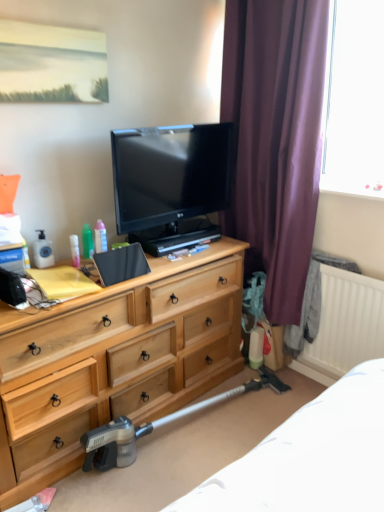
Locate an element on the screen. white matte radiator at lower right is located at coordinates (344, 326).

What do you see at coordinates (172, 183) in the screenshot? The width and height of the screenshot is (384, 512). I see `matte black tv at center` at bounding box center [172, 183].

What is the approximate width of light wood dresser at center?

light wood dresser at center is 20.67 inches wide.

What do you see at coordinates (113, 361) in the screenshot? The height and width of the screenshot is (512, 384). I see `light wood dresser at center` at bounding box center [113, 361].

Locate an element on the screen. purple velvet curtain at right is located at coordinates (275, 139).

Describe the element at coordinates (100, 237) in the screenshot. I see `translucent plastic spray bottle at center-left, acting as the 1th toiletry starting from the right` at that location.

The height and width of the screenshot is (512, 384). Identify the location of white matte radiator at lower right. (344, 326).

Based on the photo, is white matte radiator at lower right wider or thinner than translucent plastic tube at center left, marked as the third toiletry in a right-to-left arrangement?

white matte radiator at lower right is wider than translucent plastic tube at center left, marked as the third toiletry in a right-to-left arrangement.

There is a white matte radiator at lower right. At what (x,y) coordinates should I click in order to perform the action: click on the 1st toiletry above it (from the image's perspective). Please return your answer as a coordinate pair (x, y). Looking at the image, I should click on (x=75, y=251).

Is white matte radiator at lower right facing away from translucent plastic tube at center left, acting as the 1th toiletry starting from the left?

No, white matte radiator at lower right is not facing the opposite direction of translucent plastic tube at center left, acting as the 1th toiletry starting from the left.

Which is more to the left, white matte radiator at lower right or translucent plastic tube at center left, acting as the 1th toiletry starting from the left?

translucent plastic tube at center left, acting as the 1th toiletry starting from the left.

Is light wood dresser at center next to white matte radiator at lower right?

They are not placed beside each other.

From the picture: Is the position of light wood dresser at center less distant than that of white matte radiator at lower right?

That is True.

Does light wood dresser at center have a lesser width compared to white matte radiator at lower right?

No, light wood dresser at center is not thinner than white matte radiator at lower right.

Which object is further away from the camera taking this photo, translucent plastic tube at center left, marked as the third toiletry in a right-to-left arrangement, or metallic gray vacuum cleaner at lower center?

translucent plastic tube at center left, marked as the third toiletry in a right-to-left arrangement, is more distant.

Which object is positioned more to the right, translucent plastic tube at center left, acting as the 1th toiletry starting from the left, or metallic gray vacuum cleaner at lower center?

Positioned to the right is metallic gray vacuum cleaner at lower center.

From the image's perspective, is translucent plastic tube at center left, marked as the third toiletry in a right-to-left arrangement, below metallic gray vacuum cleaner at lower center?

No.

Is translucent plastic tube at center left, marked as the third toiletry in a right-to-left arrangement, wider than metallic gray vacuum cleaner at lower center?

No, translucent plastic tube at center left, marked as the third toiletry in a right-to-left arrangement, is not wider than metallic gray vacuum cleaner at lower center.

Visually, is green plastic bottle at upper left, the second toiletry from the right, positioned to the left or to the right of translucent plastic spray bottle at center-left, acting as the 1th toiletry starting from the right?

In the image, green plastic bottle at upper left, the second toiletry from the right, appears on the left side of translucent plastic spray bottle at center-left, acting as the 1th toiletry starting from the right.

Is translucent plastic spray bottle at center-left, acting as the 1th toiletry starting from the right, surrounded by green plastic bottle at upper left, the second toiletry from the right?

Definitely not — translucent plastic spray bottle at center-left, acting as the 1th toiletry starting from the right, is not inside green plastic bottle at upper left, the second toiletry from the right.

Is point (82, 238) positioned in front of point (103, 226)?

Yes, it is.

Is green plastic bottle at upper left, the second toiletry positioned from the left, wider than translucent plastic spray bottle at center-left, acting as the 1th toiletry starting from the right?

Incorrect, the width of green plastic bottle at upper left, the second toiletry positioned from the left, does not surpass that of translucent plastic spray bottle at center-left, acting as the 1th toiletry starting from the right.

Is metallic gray vacuum cleaner at lower center thinner than translucent plastic spray bottle at center-left, the 3th toiletry when ordered from left to right?

No.

Are metallic gray vacuum cleaner at lower center and translucent plastic spray bottle at center-left, the 3th toiletry when ordered from left to right, located far from each other?

No.

Is metallic gray vacuum cleaner at lower center facing away from translucent plastic spray bottle at center-left, the 3th toiletry when ordered from left to right?

No, metallic gray vacuum cleaner at lower center is not facing away from translucent plastic spray bottle at center-left, the 3th toiletry when ordered from left to right.

In the scene shown: From a real-world perspective, is metallic gray vacuum cleaner at lower center on top of translucent plastic spray bottle at center-left, acting as the 1th toiletry starting from the right?

No, from a real-world perspective, metallic gray vacuum cleaner at lower center is not over translucent plastic spray bottle at center-left, acting as the 1th toiletry starting from the right

From the picture: Is purple velvet curtain at right positioned far away from light wood dresser at center?

No, purple velvet curtain at right is not far from light wood dresser at center.

Is light wood dresser at center a part of purple velvet curtain at right?

Definitely not — light wood dresser at center is not inside purple velvet curtain at right.

Considering the sizes of objects purple velvet curtain at right and light wood dresser at center in the image provided, who is thinner, purple velvet curtain at right or light wood dresser at center?

purple velvet curtain at right is thinner.

Could you tell me if purple velvet curtain at right is turned towards light wood dresser at center?

Yes, purple velvet curtain at right is aimed at light wood dresser at center.

Who is shorter, metallic gray vacuum cleaner at lower center or translucent plastic tube at center left, acting as the 1th toiletry starting from the left?

With less height is translucent plastic tube at center left, acting as the 1th toiletry starting from the left.

Is metallic gray vacuum cleaner at lower center positioned with its back to translucent plastic tube at center left, marked as the third toiletry in a right-to-left arrangement?

No, translucent plastic tube at center left, marked as the third toiletry in a right-to-left arrangement, is not at the back of metallic gray vacuum cleaner at lower center.

Considering the positions of objects metallic gray vacuum cleaner at lower center and translucent plastic tube at center left, marked as the third toiletry in a right-to-left arrangement, in the image provided, who is more to the right, metallic gray vacuum cleaner at lower center or translucent plastic tube at center left, marked as the third toiletry in a right-to-left arrangement,?

metallic gray vacuum cleaner at lower center is more to the right.

Which is behind, point (284, 389) or point (77, 259)?

The point (284, 389) is farther from the camera.

Locate an element on the screen. This screenshot has height=512, width=384. radiator below the translucent plastic tube at center left, acting as the 1th toiletry starting from the left (from a real-world perspective) is located at coordinates (344, 326).

Where is `radiator to the right of light wood dresser at center`? This screenshot has height=512, width=384. radiator to the right of light wood dresser at center is located at coordinates (344, 326).

From the image, which object appears to be farther from purple velvet curtain at right, metallic gray vacuum cleaner at lower center or green plastic bottle at upper left, the second toiletry from the right?

metallic gray vacuum cleaner at lower center is positioned further to the anchor purple velvet curtain at right.

Which object lies further to the anchor point translucent plastic tube at center left, marked as the third toiletry in a right-to-left arrangement, white matte radiator at lower right or metallic gray vacuum cleaner at lower center?

Among the two, white matte radiator at lower right is located further to translucent plastic tube at center left, marked as the third toiletry in a right-to-left arrangement.

Considering their positions, is white matte radiator at lower right positioned closer to metallic gray vacuum cleaner at lower center than light wood dresser at center?

Among the two, light wood dresser at center is located nearer to metallic gray vacuum cleaner at lower center.

Estimate the real-world distances between objects in this image. Which object is closer to matte black tv at center, translucent plastic tube at center left, marked as the third toiletry in a right-to-left arrangement, or green plastic bottle at upper left, the second toiletry positioned from the left?

green plastic bottle at upper left, the second toiletry positioned from the left, is closer to matte black tv at center.

Estimate the real-world distances between objects in this image. Which object is further from metallic gray vacuum cleaner at lower center, purple velvet curtain at right or white matte radiator at lower right?

purple velvet curtain at right lies further to metallic gray vacuum cleaner at lower center than the other object.

Based on their spatial positions, is metallic gray vacuum cleaner at lower center or purple velvet curtain at right further from light wood dresser at center?

purple velvet curtain at right is further to light wood dresser at center.

From the picture: Considering their positions, is green plastic bottle at upper left, the second toiletry positioned from the left, positioned further to matte black tv at center than white matte radiator at lower right?

Among the two, white matte radiator at lower right is located further to matte black tv at center.

Which object lies further to the anchor point white matte radiator at lower right, translucent plastic tube at center left, marked as the third toiletry in a right-to-left arrangement, or light wood dresser at center?

translucent plastic tube at center left, marked as the third toiletry in a right-to-left arrangement, is positioned further to the anchor white matte radiator at lower right.

The width and height of the screenshot is (384, 512). In order to click on television located between translucent plastic tube at center left, acting as the 1th toiletry starting from the left, and purple velvet curtain at right in the left-right direction in this screenshot , I will do `click(172, 183)`.

This screenshot has width=384, height=512. I want to click on chest of drawers between translucent plastic tube at center left, acting as the 1th toiletry starting from the left, and metallic gray vacuum cleaner at lower center from top to bottom, so click(113, 361).

At what (x,y) coordinates should I click in order to perform the action: click on toiletry between translucent plastic spray bottle at center-left, the 3th toiletry when ordered from left to right, and metallic gray vacuum cleaner at lower center in the up-down direction. Please return your answer as a coordinate pair (x, y). Looking at the image, I should click on (75, 251).

What are the coordinates of `television between purple velvet curtain at right and white matte radiator at lower right vertically` in the screenshot? It's located at (172, 183).